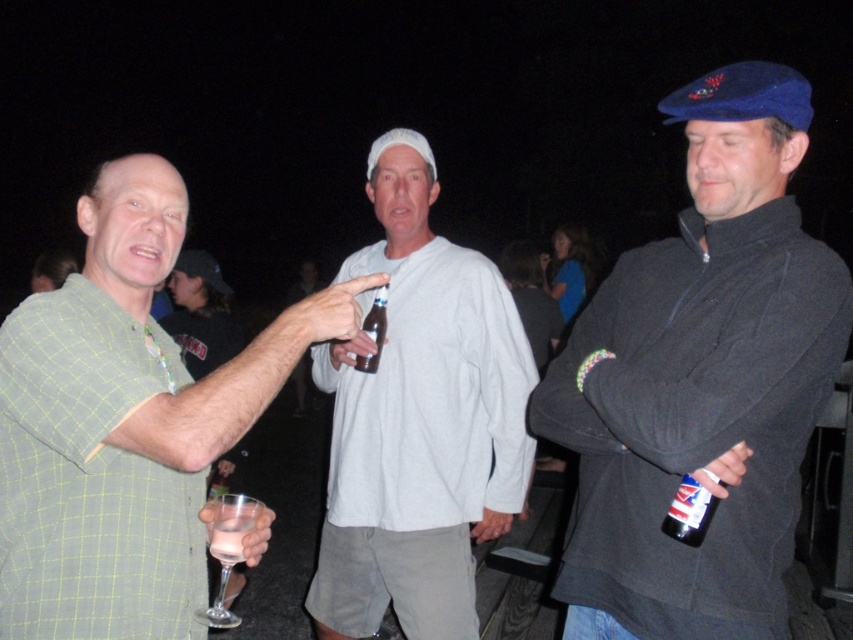
Which is more to the left, white matte shirt at center or dark glass bottle at right?

Positioned to the left is white matte shirt at center.

Locate an element on the screen. Image resolution: width=853 pixels, height=640 pixels. white matte shirt at center is located at coordinates (419, 420).

Find the location of a particular element. white matte shirt at center is located at coordinates (419, 420).

You are a GUI agent. You are given a task and a screenshot of the screen. Output one action in this format:
    pyautogui.click(x=<x>, y=<y>)
    Task: Click on the dark blue fleece jacket at center
    The height and width of the screenshot is (640, 853).
    Given the screenshot: What is the action you would take?
    pyautogui.click(x=700, y=380)

Does dark blue fleece jacket at center have a greater height compared to clear glass bottle at center?

Yes, dark blue fleece jacket at center is taller than clear glass bottle at center.

Between point (643, 628) and point (375, 356), which one is positioned behind?

The point (375, 356) is more distant.

Locate an element on the screen. The image size is (853, 640). dark blue fleece jacket at center is located at coordinates (700, 380).

Who is higher up, white matte shirt at center or clear plastic cup at lower left?

Positioned higher is white matte shirt at center.

Does white matte shirt at center have a greater height compared to clear plastic cup at lower left?

Yes.

Who is more distant from viewer, (410, 300) or (234, 529)?

Point (410, 300)

Identify the location of white matte shirt at center. (419, 420).